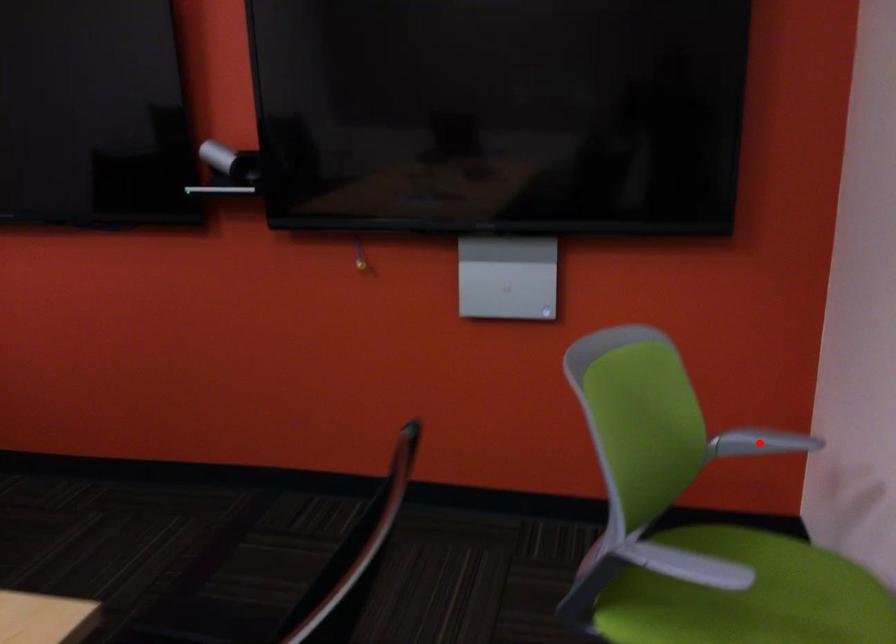
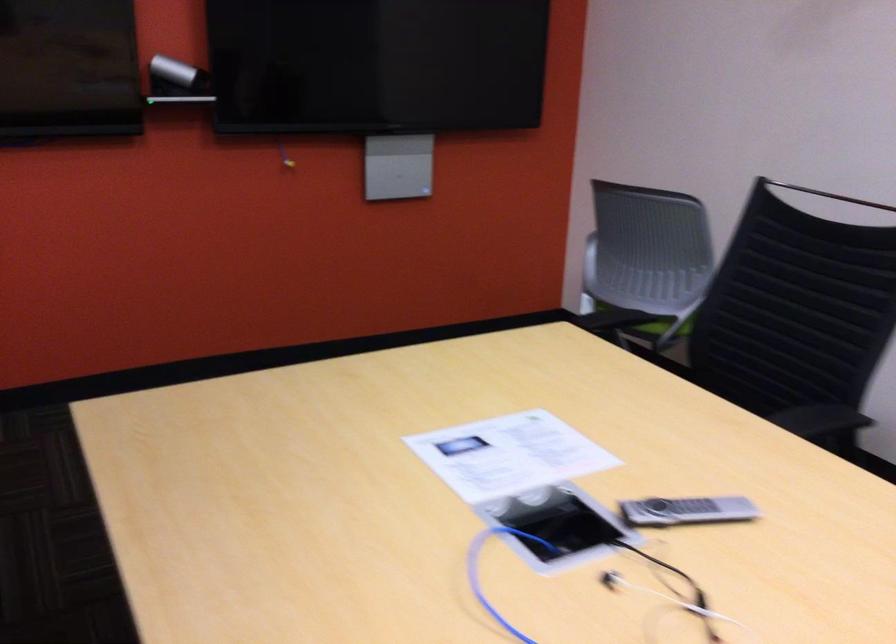
Question: I am providing you with two images of the same scene from different viewpoints. A red point is marked on the first image. Can you still see the location of the red point in image 2?

Choices:
 (A) Yes
 (B) No

Answer: (B)